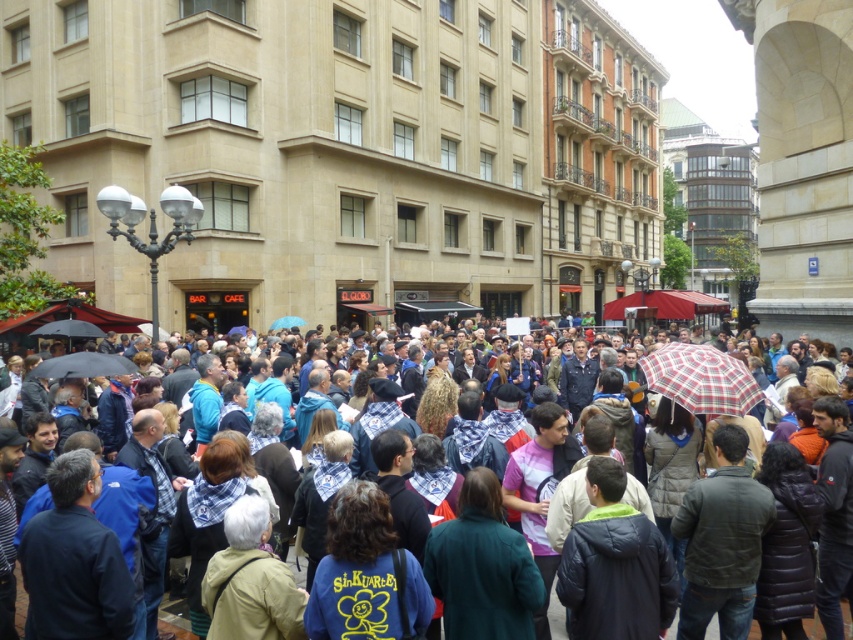
You are standing in the crowd holding a black matte umbrella at center and want to move towards the beige building on the left. Which direction should you turn to avoid the black matte umbrella at lower left?

The black matte umbrella at center is positioned on the right side of the black matte umbrella at lower left. To avoid it, turn left towards the beige building on the left.

You are standing in the urban square and want to reach the modern glass building with rounded edges in the background. There is a black matte umbrella at lower left at point (68,330). Can you walk directly towards the building without passing near the umbrella?

The black matte umbrella at lower left is located at point (68,330). Since the modern glass building is further back, you would need to walk past the area where the umbrella is positioned, so you would pass near the umbrella on your way.

You are organizing an outdoor event in the plaza and need to place a 1.2 meter wide banner between the plaid fabric umbrella at center and the black matte umbrella at lower left. Will the banner fit between them?

The plaid fabric umbrella at center is narrower than the black matte umbrella at lower left. However, the distance between them isn not specified in the object descriptions. Therefore, it is impossible to determine if the banner will fit based on the given information.